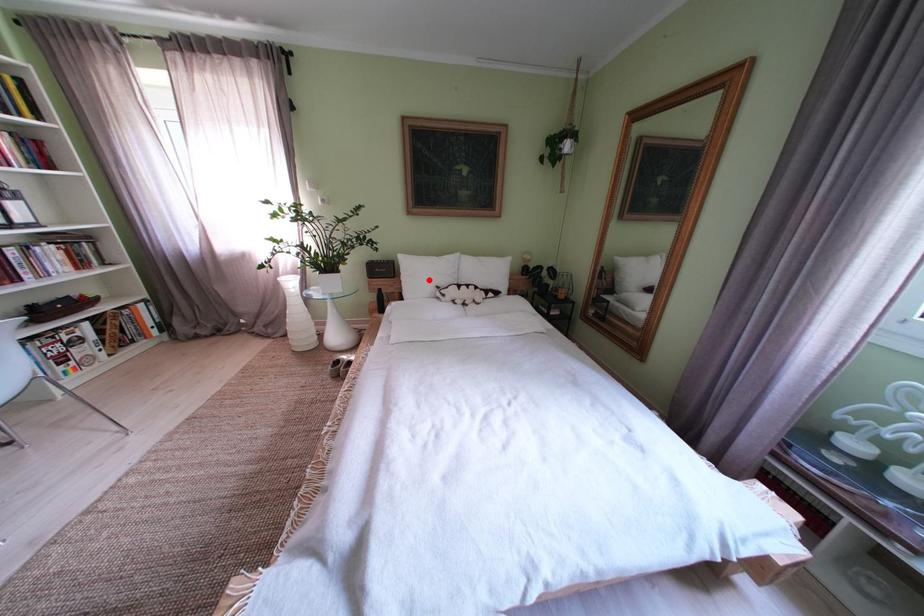
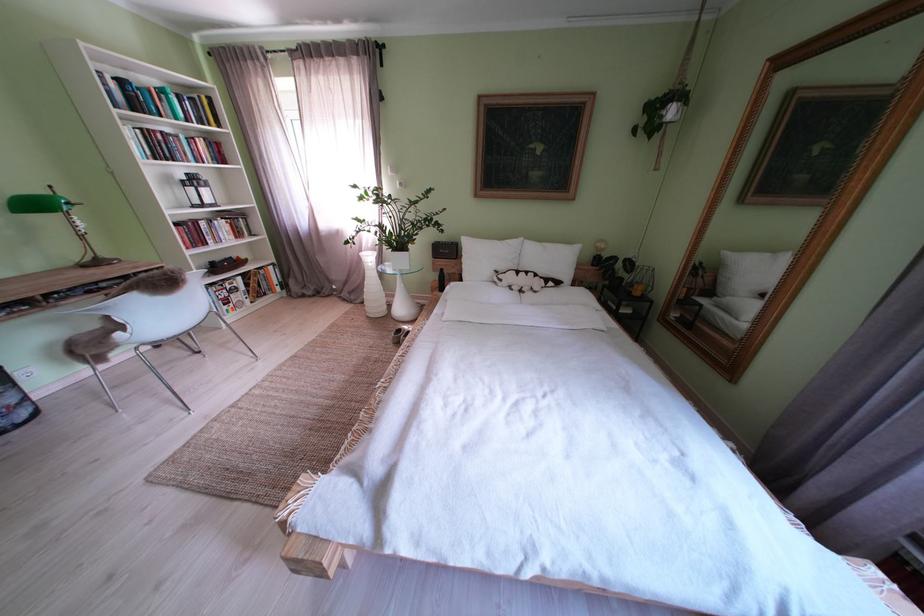
Question: I am providing you with two images of the same scene from different viewpoints. A red point is marked on the first image. Can you still see the location of the red point in image 2?

Choices:
 (A) Yes
 (B) No

Answer: (A)